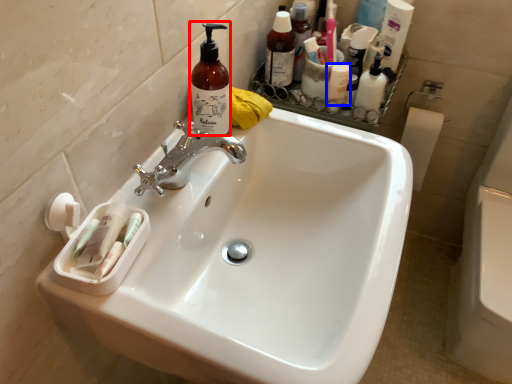
Question: Which object appears farthest to the camera in this image, cleaning product (highlighted by a red box) or mouthwash (highlighted by a blue box)?

Choices:
 (A) cleaning product
 (B) mouthwash

Answer: (B)